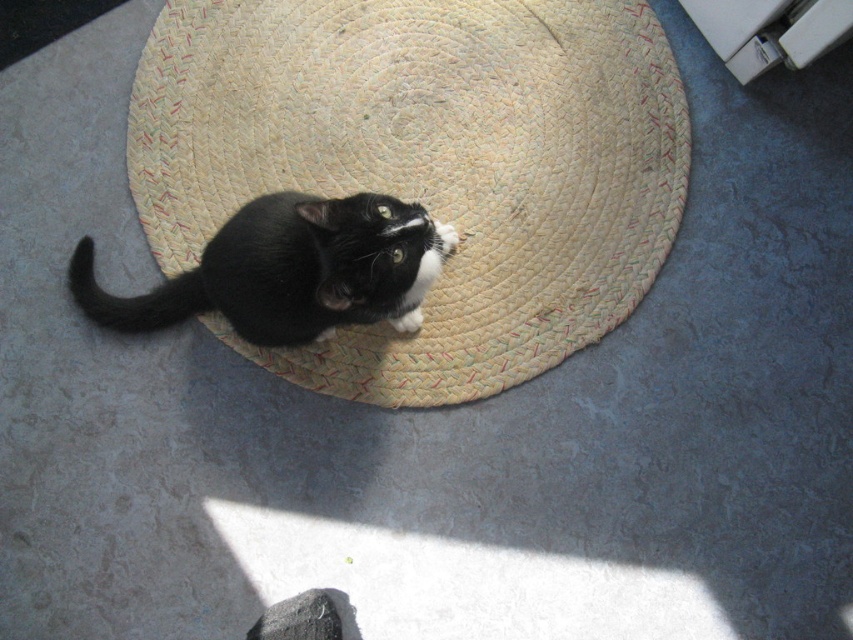
You are standing in a room and see a natural woven straw hat at center and a black matte fur cat at center. Which object is positioned more to the right side of the room?

The natural woven straw hat at center is positioned more to the right side of the room compared to the black matte fur cat at center.

You are standing in the room where the black and white cat is sitting on the circular mat. You want to place a small treat exactly at point (x=648, y=86). If your hand is 1.5 meters away from the cat, will you be able to reach the point without moving closer?

The distance of point (x=648, y=86) from viewer is 1.63 meters. Since your hand is 1.5 meters away from the cat, you are 1.5 meters away from the cat but the point is 1.63 meters away from you, so you cannot reach the point without moving closer.